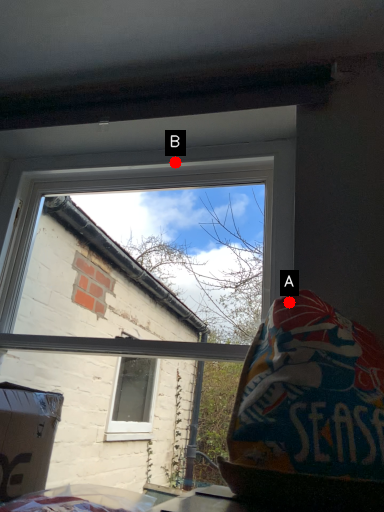
Question: Two points are circled on the image, labeled by A and B beside each circle. Which point is closer to the camera taking this photo?

Choices:
 (A) A is closer
 (B) B is closer

Answer: (A)